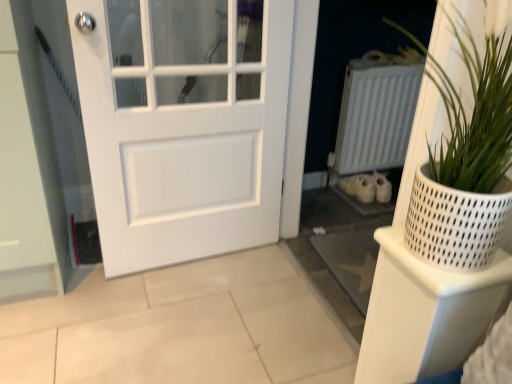
Question: Is white textured pot at right shorter than white matte door at center?

Choices:
 (A) yes
 (B) no

Answer: (A)

Question: Is white textured pot at right smaller than white matte door at center?

Choices:
 (A) no
 (B) yes

Answer: (B)

Question: Does white textured pot at right have a lesser width compared to white matte door at center?

Choices:
 (A) no
 (B) yes

Answer: (A)

Question: Is white textured pot at right to the left of white matte door at center from the viewer's perspective?

Choices:
 (A) no
 (B) yes

Answer: (A)

Question: Does white textured pot at right touch white matte door at center?

Choices:
 (A) no
 (B) yes

Answer: (A)

Question: From a real-world perspective, does white textured pot at right stand above white matte door at center?

Choices:
 (A) yes
 (B) no

Answer: (A)

Question: Considering the relative positions of white matte radiator at center right and white matte door at center in the image provided, is white matte radiator at center right to the left of white matte door at center from the viewer's perspective?

Choices:
 (A) no
 (B) yes

Answer: (A)

Question: Could you tell me if white matte radiator at center right is facing white matte door at center?

Choices:
 (A) yes
 (B) no

Answer: (B)

Question: Is white matte radiator at center right in front of white matte door at center?

Choices:
 (A) yes
 (B) no

Answer: (B)

Question: Considering the relative sizes of white matte radiator at center right and white matte door at center in the image provided, is white matte radiator at center right thinner than white matte door at center?

Choices:
 (A) no
 (B) yes

Answer: (A)

Question: Are white matte radiator at center right and white matte door at center beside each other?

Choices:
 (A) yes
 (B) no

Answer: (B)

Question: From the image's perspective, is white matte radiator at center right beneath white matte door at center?

Choices:
 (A) no
 (B) yes

Answer: (A)

Question: Does white textured pot at right have a greater width compared to white plastic shelf at right?

Choices:
 (A) no
 (B) yes

Answer: (A)